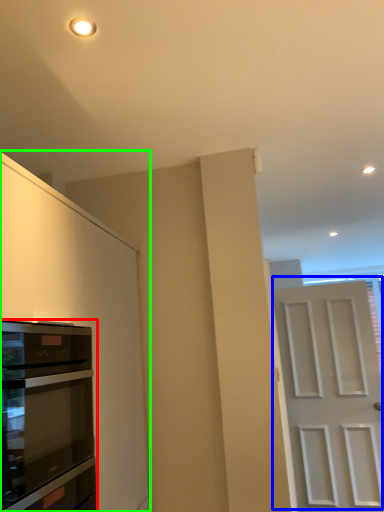
Question: Based on their relative distances, which object is nearer to oven (highlighted by a red box)? Choose from door (highlighted by a blue box) and cabinetry (highlighted by a green box).

Choices:
 (A) door
 (B) cabinetry

Answer: (B)